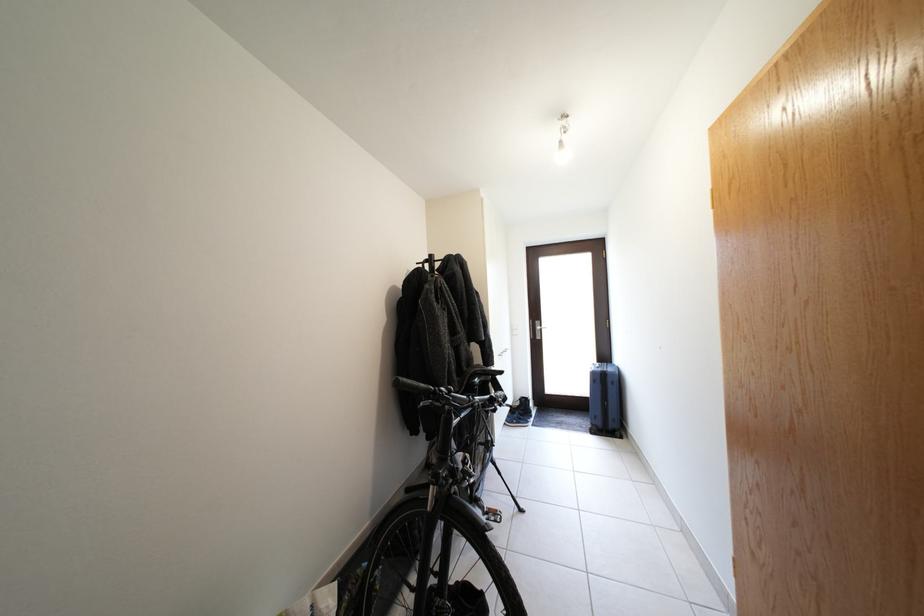
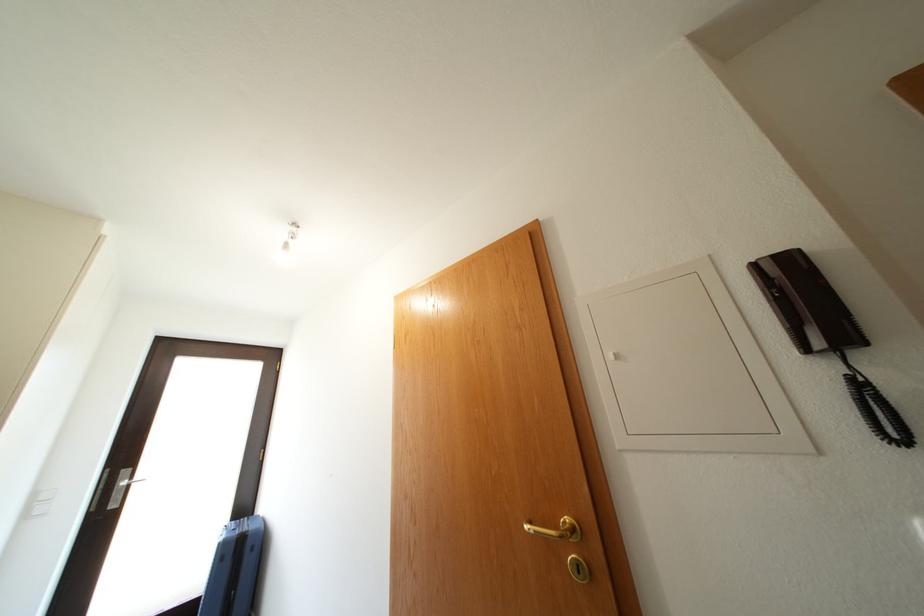
The images are taken continuously from a first-person perspective. In which direction is your viewpoint rotating?

The camera rotated toward right-up.